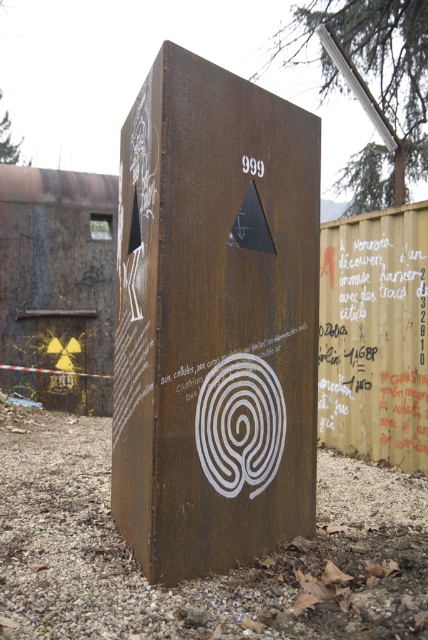
Question: Which object appears farthest from the camera in this image?

Choices:
 (A) rusty metal box at center
 (B) red painted text at right

Answer: (B)

Question: Which of the following is the farthest from the observer?

Choices:
 (A) [x=401, y=417]
 (B) [x=205, y=410]

Answer: (A)

Question: Is rusty metal box at center wider than red painted text at right?

Choices:
 (A) yes
 (B) no

Answer: (A)

Question: Is rusty metal box at center to the right of red painted text at right from the viewer's perspective?

Choices:
 (A) yes
 (B) no

Answer: (B)

Question: Is rusty metal box at center closer to camera compared to red painted text at right?

Choices:
 (A) yes
 (B) no

Answer: (A)